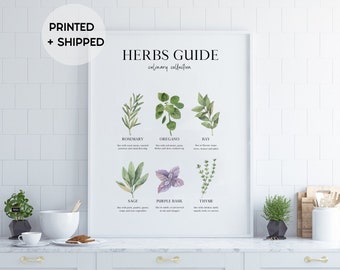
Identify the location of drawers. Image resolution: width=340 pixels, height=270 pixels. (76, 262), (123, 263), (265, 257).